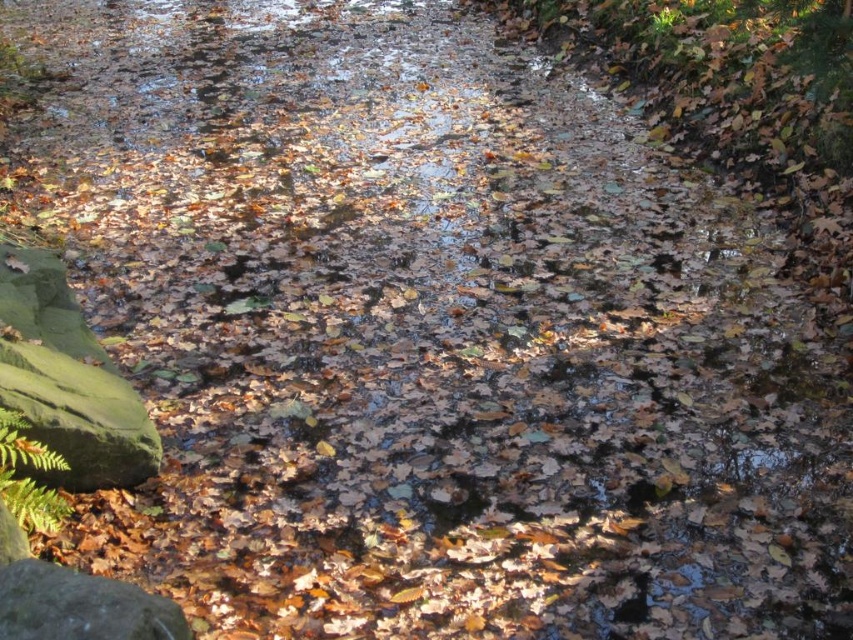
Consider the image. You are a hiker standing at the edge of the stream and want to place your backpack on the nearest rock. Which rock should you choose between the green mossy rock at lower left and the matte gray rock at lower left?

The green mossy rock at lower left is closer to you than the matte gray rock at lower left, so you should place your backpack on the green mossy rock at lower left.

You are a hiker who wants to cross the stream carefully. You see the green mossy rock at lower left and the matte gray rock at lower left. Which rock should you step on to avoid slipping?

The green mossy rock at lower left is bigger than the matte gray rock at lower left, so stepping on the green mossy rock at lower left provides a more stable footing to avoid slipping.

You are a photographer standing in the forest and want to capture both the point at coordinates point (55, 348) and point (3, 605) in your shot. Which point should be placed closer to the camera to ensure both are in focus?

Point (55, 348) is further to the viewer than point (3, 605), so to ensure both are in focus, place the point closer to the camera at point (3, 605).